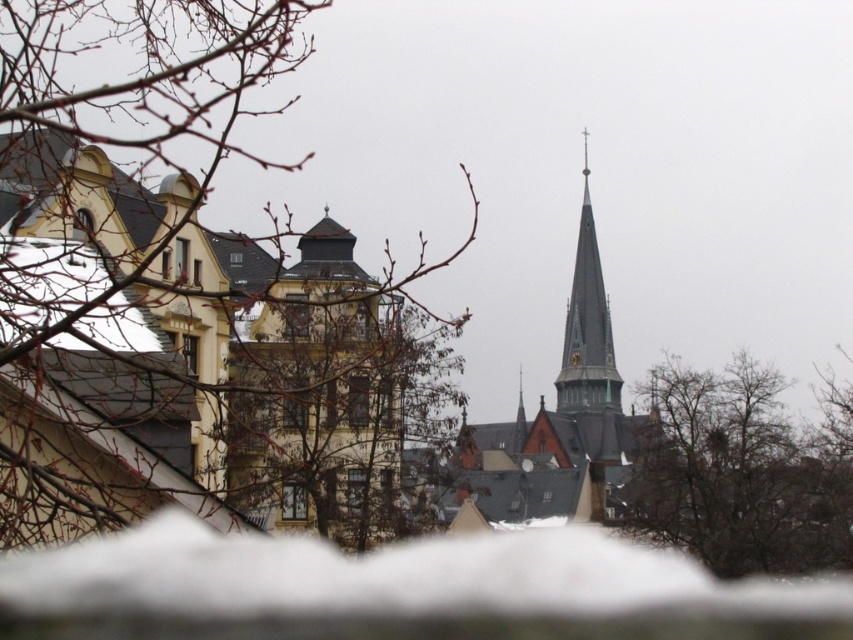
Question: Can you confirm if white fluffy snow at lower center is bigger than brown leafless tree at lower right?

Choices:
 (A) no
 (B) yes

Answer: (B)

Question: Which of these objects is positioned closest to the gray stone church steeple at center?

Choices:
 (A) brown leafless tree at lower right
 (B) smooth gray steeple at center

Answer: (B)

Question: Does brown leafless tree at lower right have a lesser width compared to smooth gray steeple at center?

Choices:
 (A) yes
 (B) no

Answer: (B)

Question: Can you confirm if gray stone church steeple at center is bigger than smooth gray steeple at center?

Choices:
 (A) no
 (B) yes

Answer: (B)

Question: Which is nearer to the gray stone church steeple at center?

Choices:
 (A) brown leafless tree at lower right
 (B) smooth gray steeple at center
 (C) bare branches at left
 (D) white fluffy snow at lower center

Answer: (B)

Question: Which object is farther from the camera taking this photo?

Choices:
 (A) bare branches at left
 (B) smooth gray steeple at center

Answer: (B)